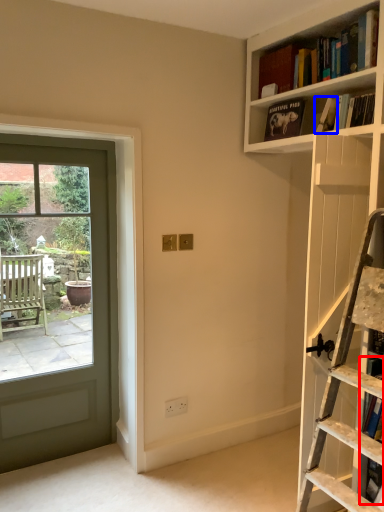
Question: Which object is closer to the camera taking this photo, book (highlighted by a red box) or book (highlighted by a blue box)?

Choices:
 (A) book
 (B) book

Answer: (A)